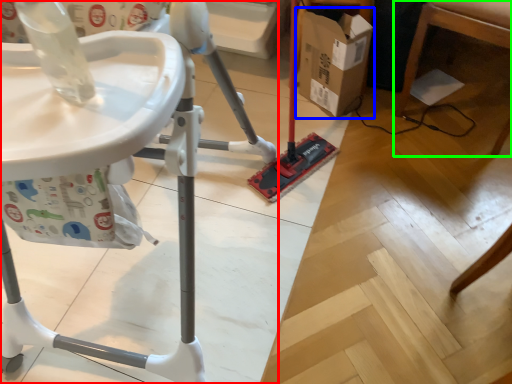
Question: Considering the real-world distances, which object is farthest from furniture (highlighted by a red box)? cardboard box (highlighted by a blue box) or furniture (highlighted by a green box)?

Choices:
 (A) cardboard box
 (B) furniture

Answer: (B)